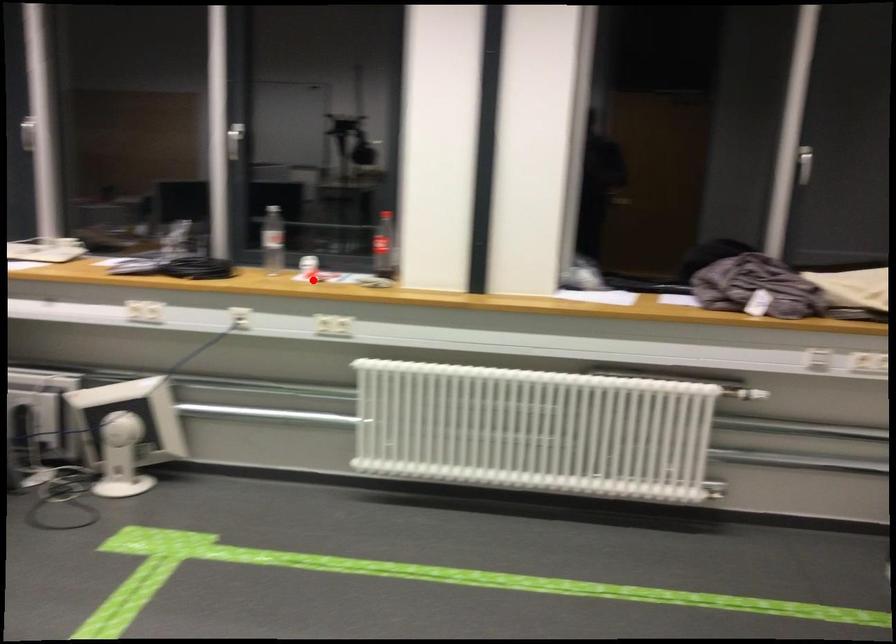
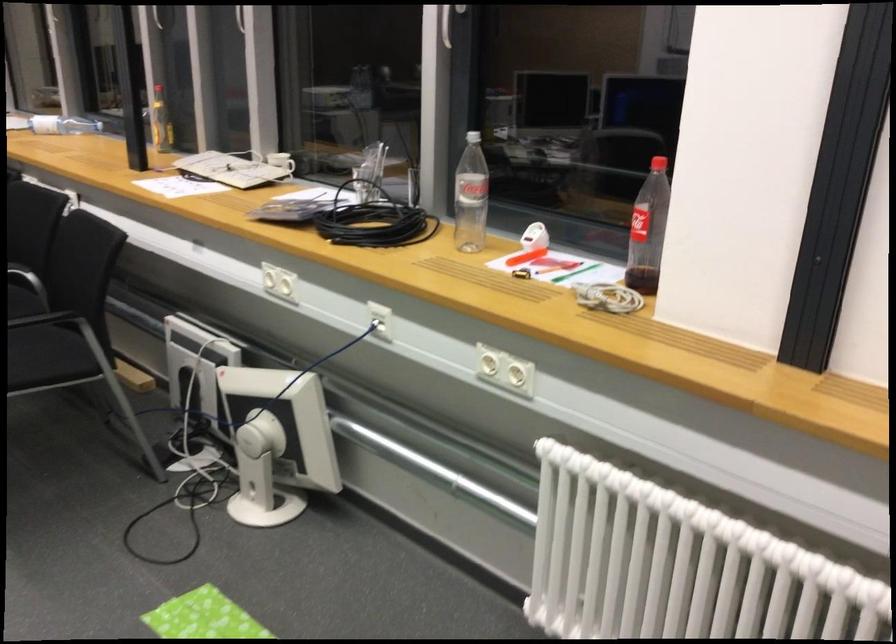
Question: I am providing you with two images of the same scene from different viewpoints. In image1, a red point is highlighted. Considering the same 3D point in image2, which of the following is correct?

Choices:
 (A) It is closer
 (B) It is farther

Answer: (A)